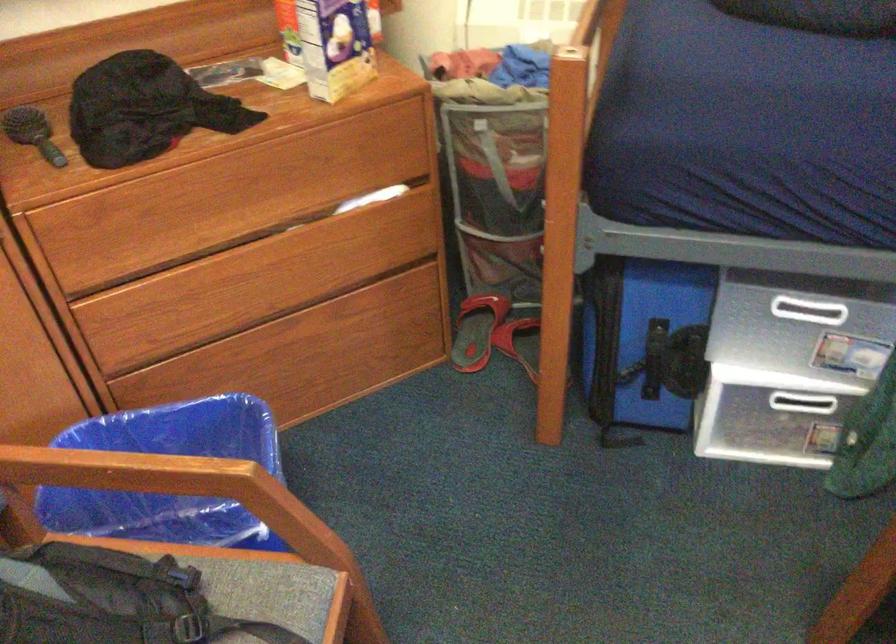
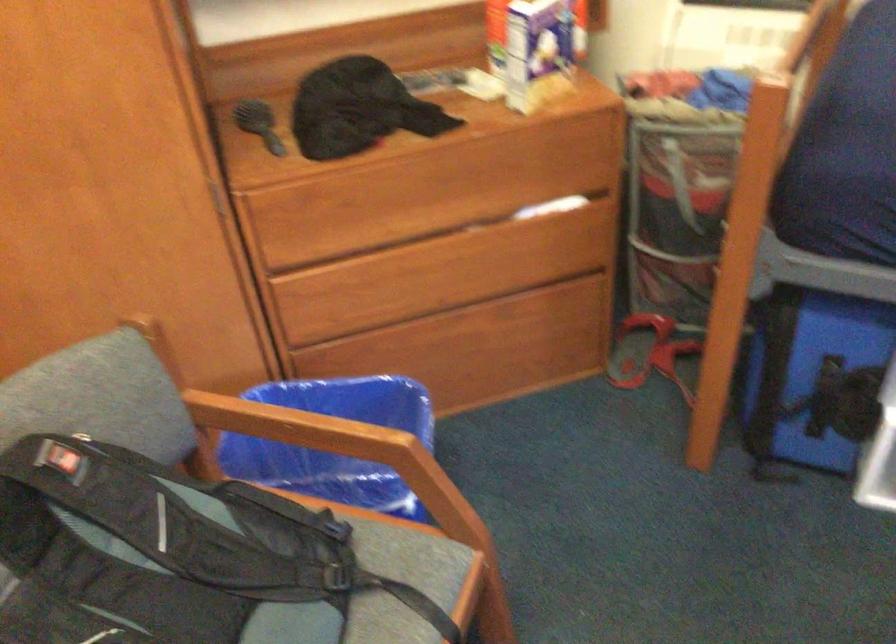
The point at (116, 468) is marked in the first image. Where is the corresponding point in the second image?

(290, 424)